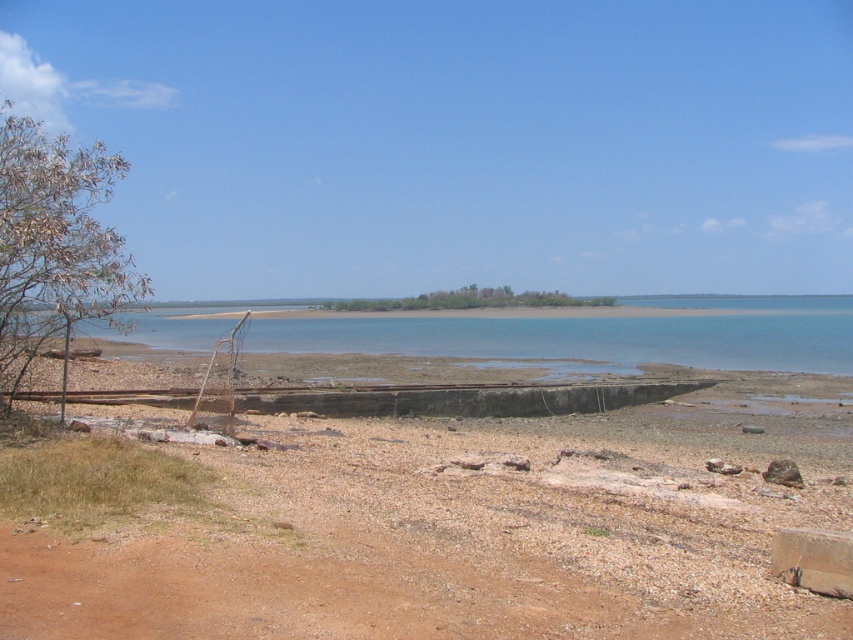
You are standing on the beach and want to take a photo of the green leafy tree at left and the blue water at center. Which object will appear closer to the camera in the photo?

The blue water at center will appear closer to the camera in the photo because the green leafy tree at left is behind it.